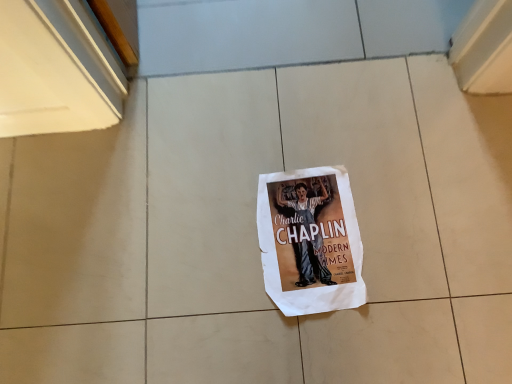
Identify the location of vacant space behind white paper poster at center. The image size is (512, 384). (289, 107).